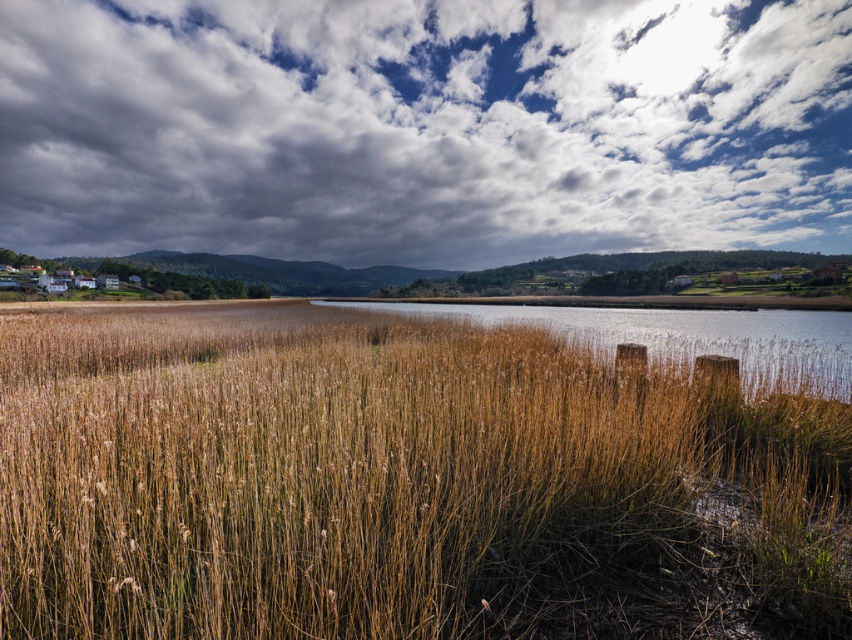
Who is positioned more to the right, brown dry grass at center or brown grassy reeds at center?

brown grassy reeds at center is more to the right.

Is point (332, 600) less distant than point (620, 321)?

Yes, point (332, 600) is in front of point (620, 321).

Identify the location of brown dry grass at center. This screenshot has width=852, height=640. (403, 484).

Which is more to the right, cloudy sky at upper center or brown grassy reeds at center?

From the viewer's perspective, brown grassy reeds at center appears more on the right side.

From the picture: Is cloudy sky at upper center taller than brown grassy reeds at center?

Correct, cloudy sky at upper center is much taller as brown grassy reeds at center.

Find the location of a particular element. The image size is (852, 640). cloudy sky at upper center is located at coordinates (423, 128).

Does brown dry grass at center have a lesser width compared to cloudy sky at upper center?

Indeed, brown dry grass at center has a lesser width compared to cloudy sky at upper center.

Between brown dry grass at center and cloudy sky at upper center, which one has less height?

brown dry grass at center

At what (x,y) coordinates should I click in order to perform the action: click on brown dry grass at center. Please return your answer as a coordinate pair (x, y). The image size is (852, 640). Looking at the image, I should click on (403, 484).

Image resolution: width=852 pixels, height=640 pixels. I want to click on brown dry grass at center, so click(403, 484).